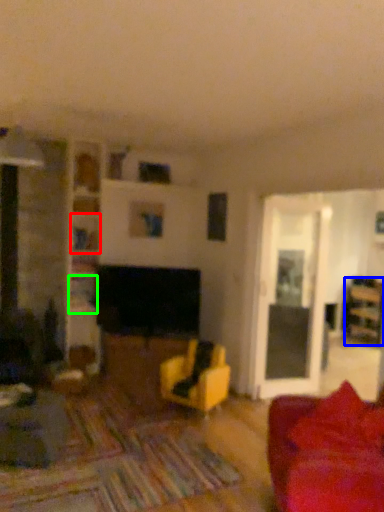
Question: Considering the real-world distances, which object is farthest from shelf (highlighted by a red box)? furniture (highlighted by a blue box) or shelf (highlighted by a green box)?

Choices:
 (A) furniture
 (B) shelf

Answer: (A)